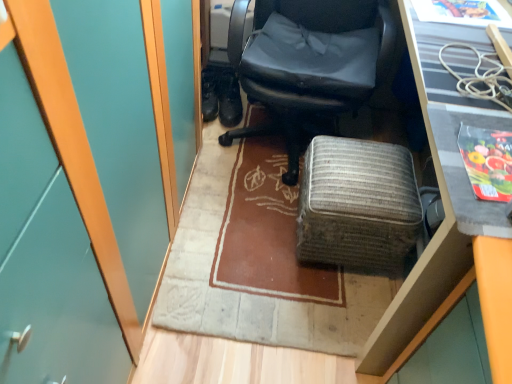
Question: Does woven fabric ottoman at center have a greater width compared to black textured desk at upper right?

Choices:
 (A) yes
 (B) no

Answer: (B)

Question: Considering the relative sizes of woven fabric ottoman at center and black textured desk at upper right in the image provided, is woven fabric ottoman at center thinner than black textured desk at upper right?

Choices:
 (A) no
 (B) yes

Answer: (B)

Question: Can you confirm if woven fabric ottoman at center is shorter than black textured desk at upper right?

Choices:
 (A) no
 (B) yes

Answer: (B)

Question: Is black textured desk at upper right completely or partially inside woven fabric ottoman at center?

Choices:
 (A) no
 (B) yes

Answer: (A)

Question: Does woven fabric ottoman at center appear on the left side of black textured desk at upper right?

Choices:
 (A) no
 (B) yes

Answer: (B)

Question: In terms of height, does black leather boot at center, acting as the second footwear starting from the left, look taller or shorter compared to woven fabric ottoman at center?

Choices:
 (A) short
 (B) tall

Answer: (A)

Question: Considering the positions of point (221, 87) and point (330, 172), is point (221, 87) closer or farther from the camera than point (330, 172)?

Choices:
 (A) closer
 (B) farther

Answer: (B)

Question: Which is correct: black leather boot at center, acting as the second footwear starting from the left, is inside woven fabric ottoman at center, or outside of it?

Choices:
 (A) outside
 (B) inside

Answer: (A)

Question: Is black leather boot at center, acting as the second footwear starting from the left, bigger or smaller than woven fabric ottoman at center?

Choices:
 (A) big
 (B) small

Answer: (B)

Question: From a real-world perspective, is black leather shoes at lower left, the 1th footwear positioned from the left, physically located above or below matte black office chair at center?

Choices:
 (A) above
 (B) below

Answer: (B)

Question: Would you say black leather shoes at lower left, arranged as the 2th footwear when viewed from the right, is to the left or to the right of matte black office chair at center in the picture?

Choices:
 (A) left
 (B) right

Answer: (A)

Question: From their relative heights in the image, would you say black leather shoes at lower left, the 1th footwear positioned from the left, is taller or shorter than matte black office chair at center?

Choices:
 (A) tall
 (B) short

Answer: (B)

Question: In the image, is black leather shoes at lower left, arranged as the 2th footwear when viewed from the right, positioned in front of or behind matte black office chair at center?

Choices:
 (A) front
 (B) behind

Answer: (B)

Question: In the image, is black textured desk at upper right positioned in front of or behind black leather boot at center, acting as the second footwear starting from the left?

Choices:
 (A) behind
 (B) front

Answer: (B)

Question: Is black textured desk at upper right taller or shorter than black leather boot at center, which is the first footwear from right to left?

Choices:
 (A) tall
 (B) short

Answer: (A)